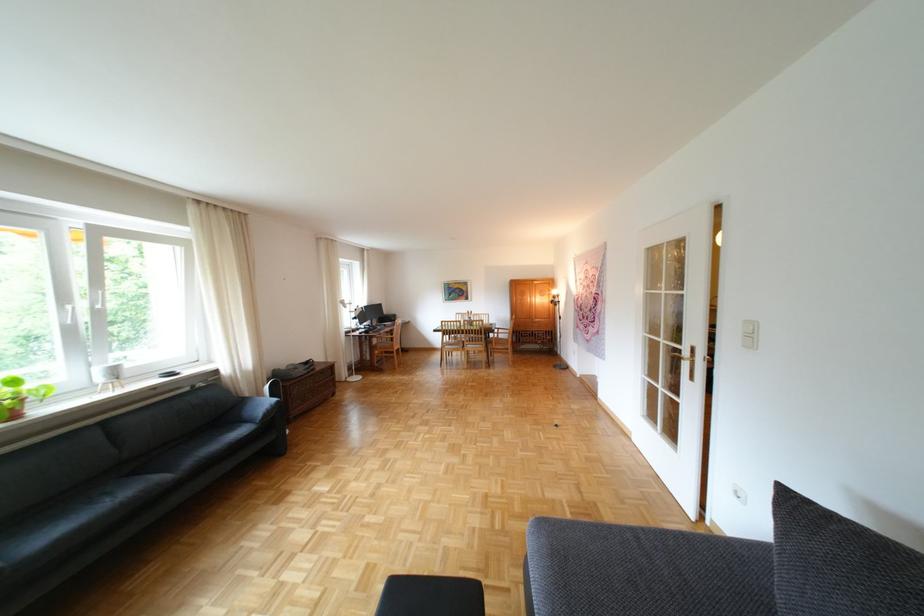
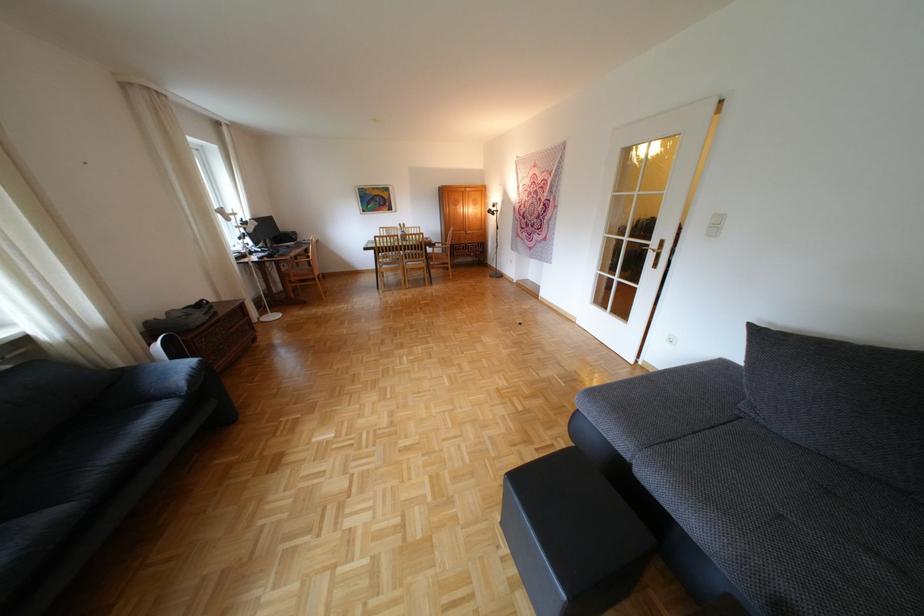
The images are taken continuously from a first-person perspective. In which direction is your viewpoint rotating?

The camera's rotation is toward right-down.